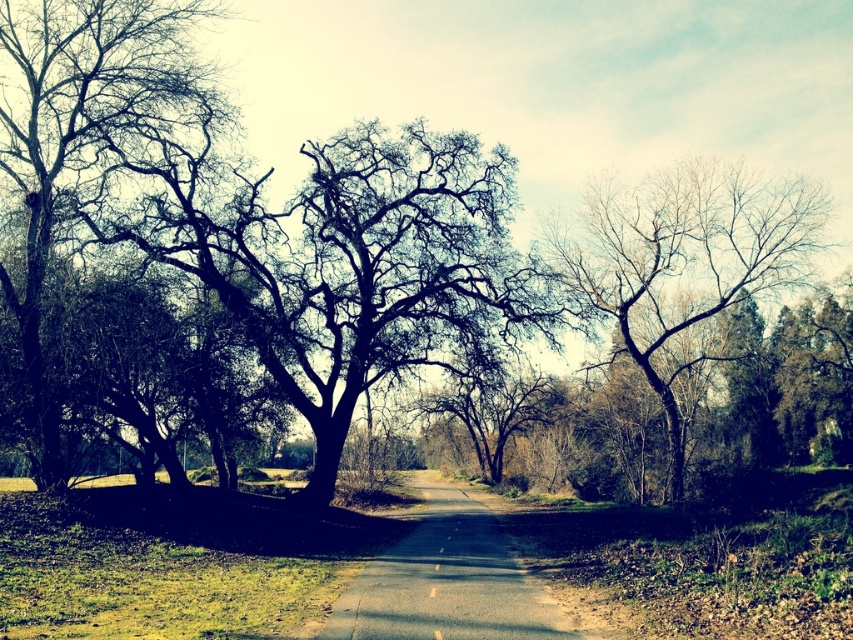
You are standing at the point marked as point (373, 272) in the image. What object is exactly at your current location?

The dark brown bark tree at center is located at point (373, 272), so the object at your current location is the dark brown bark tree at center.

You are standing at the point marked as point (76, 138) in the image. What object are you currently standing on?

You are standing on the dark green textured tree at left.